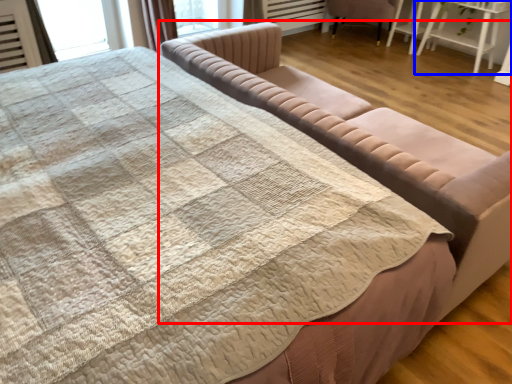
Question: Which point is further to the camera, studio couch (highlighted by a red box) or table (highlighted by a blue box)?

Choices:
 (A) studio couch
 (B) table

Answer: (B)